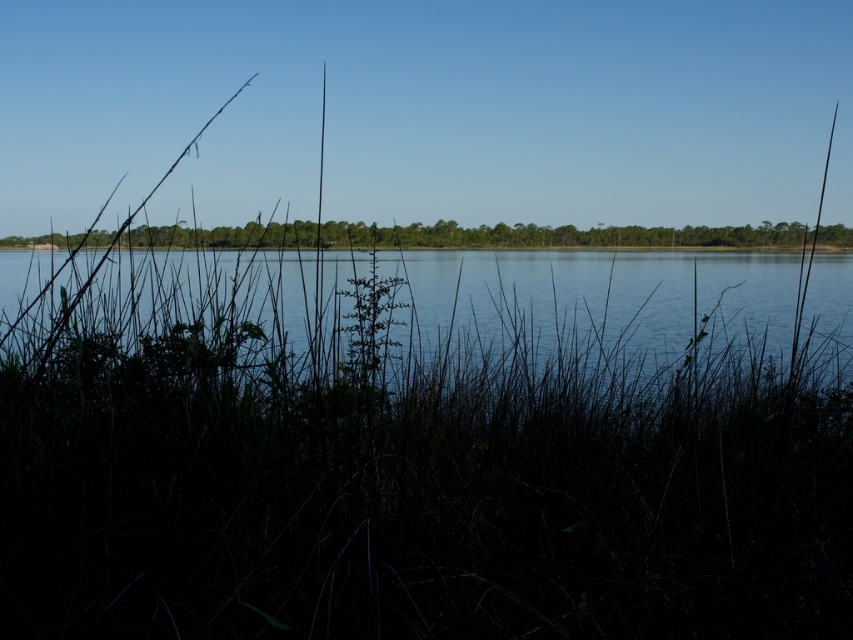
You are an observer standing at the lakeside. You see the clear water at center and the green leafy plant at center. Which object is located to the right side of the other?

The clear water at center is positioned on the right side of the green leafy plant at center.

You are standing at the edge of the lake and want to place a small decorative rock exactly at the center of the image. Given that the green matte grass at center is located at point coordinates of 0.709, 0.506, can you determine if the grass is at the true center of the image?

The true center of an image is at coordinates (426,320). The green matte grass at center is located at (431,452), which is slightly to the right of the true center. Therefore, the grass is not at the true center of the image.

Consider the image. You are an environmental scientist analyzing the vegetation in the image. You need to determine which of the two plants, the green matte grass at center or the green leafy plant at center, requires more space to grow. Based on the scene description, which plant would you recommend for a larger garden area?

The green matte grass at center is larger in size than the green leafy plant at center, so it requires more space to grow. Therefore, the green matte grass at center would be more suitable for a larger garden area.